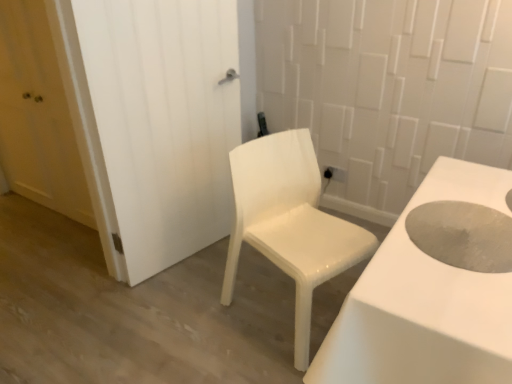
Question: Is white glossy chair at center positioned with its back to matte white door at left, which ranks as the 2th door in right-to-left order?

Choices:
 (A) no
 (B) yes

Answer: (B)

Question: Can you confirm if white glossy chair at center is wider than matte white door at left, which ranks as the 1th door in left-to-right order?

Choices:
 (A) no
 (B) yes

Answer: (B)

Question: Is white glossy chair at center bigger than matte white door at left, which ranks as the 1th door in left-to-right order?

Choices:
 (A) no
 (B) yes

Answer: (B)

Question: From the image's perspective, does white glossy chair at center appear lower than matte white door at left, which ranks as the 1th door in left-to-right order?

Choices:
 (A) yes
 (B) no

Answer: (A)

Question: Would you say matte white door at left, which ranks as the 2th door in right-to-left order, is part of white glossy chair at center's contents?

Choices:
 (A) no
 (B) yes

Answer: (A)

Question: Is there a large distance between white glossy chair at center and matte white door at left, which ranks as the 2th door in right-to-left order?

Choices:
 (A) no
 (B) yes

Answer: (B)

Question: Considering the relative sizes of gray matte hole at center right and white glossy chair at center in the image provided, is gray matte hole at center right bigger than white glossy chair at center?

Choices:
 (A) yes
 (B) no

Answer: (B)

Question: From the image's perspective, is gray matte hole at center right beneath white glossy chair at center?

Choices:
 (A) yes
 (B) no

Answer: (B)

Question: Are gray matte hole at center right and white glossy chair at center located far from each other?

Choices:
 (A) yes
 (B) no

Answer: (B)

Question: Is gray matte hole at center right surrounding white glossy chair at center?

Choices:
 (A) yes
 (B) no

Answer: (B)

Question: Does gray matte hole at center right have a greater width compared to white glossy chair at center?

Choices:
 (A) yes
 (B) no

Answer: (B)

Question: Considering the relative sizes of gray matte hole at center right and white glossy chair at center in the image provided, is gray matte hole at center right shorter than white glossy chair at center?

Choices:
 (A) yes
 (B) no

Answer: (A)

Question: Is matte white door at left, which ranks as the 1th door in left-to-right order, at the right side of white glossy chair at center?

Choices:
 (A) no
 (B) yes

Answer: (A)